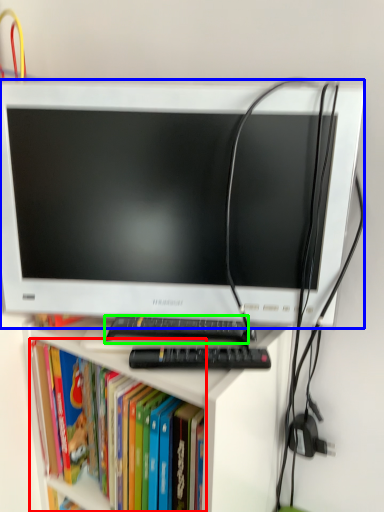
Question: Estimate the real-world distances between objects in this image. Which object is farther from book (highlighted by a red box), computer monitor (highlighted by a blue box) or keyboard (highlighted by a green box)?

Choices:
 (A) computer monitor
 (B) keyboard

Answer: (A)